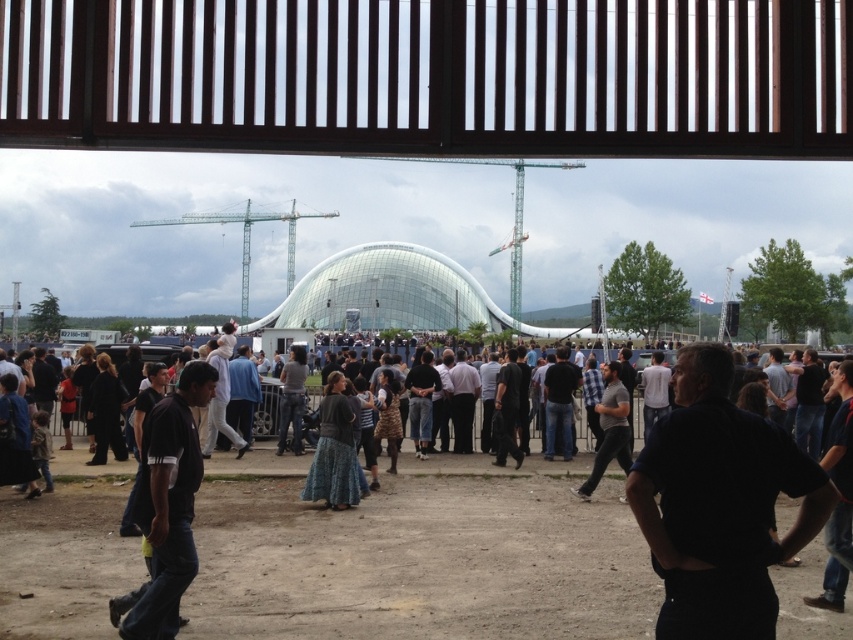
What do you see at coordinates (169, 502) in the screenshot? The width and height of the screenshot is (853, 640). I see `dark blue jeans at lower left` at bounding box center [169, 502].

Is dark blue jeans at lower left above denim skirt at center?

Correct, dark blue jeans at lower left is located above denim skirt at center.

Identify the location of dark blue jeans at lower left. click(169, 502).

You are a GUI agent. You are given a task and a screenshot of the screen. Output one action in this format:
    pyautogui.click(x=<x>, y=<y>)
    Task: Click on the dark blue jeans at lower left
    The image size is (853, 640).
    Given the screenshot: What is the action you would take?
    pyautogui.click(x=169, y=502)

Between dark blue jeans at center and dark blue shirt at center, which one appears on the right side from the viewer's perspective?

dark blue shirt at center is more to the right.

Is point (305, 625) closer to viewer compared to point (827, 497)?

No, it is behind (827, 497).

The height and width of the screenshot is (640, 853). Find the location of `dark blue jeans at center`. dark blue jeans at center is located at coordinates (419, 556).

Is dark blue shirt at center shorter than denim skirt at center?

Indeed, dark blue shirt at center has a lesser height compared to denim skirt at center.

Is dark blue shirt at center further to camera compared to denim skirt at center?

No.

Does point (724, 397) come closer to viewer compared to point (317, 484)?

Yes.

The width and height of the screenshot is (853, 640). In order to click on dark blue shirt at center in this screenshot , I will do `click(718, 504)`.